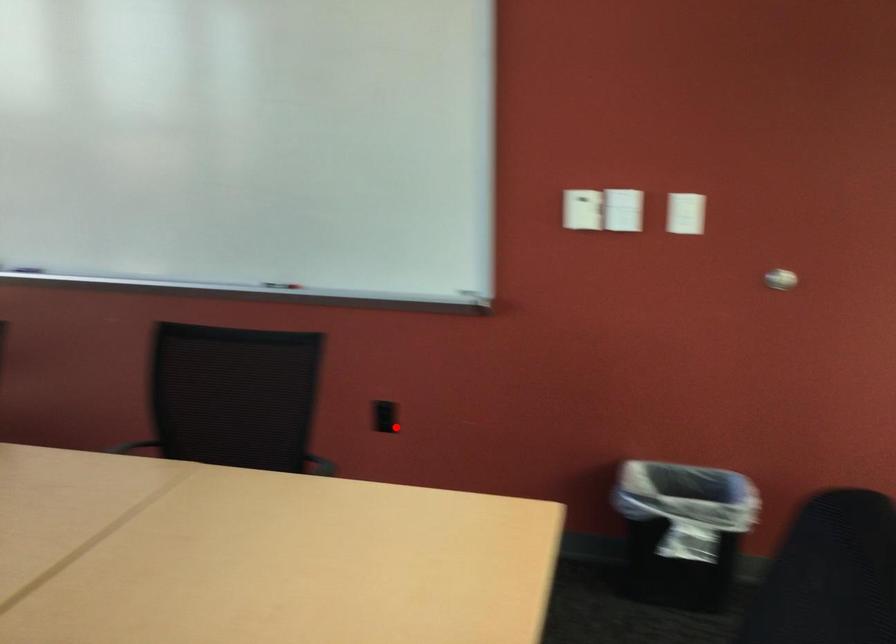
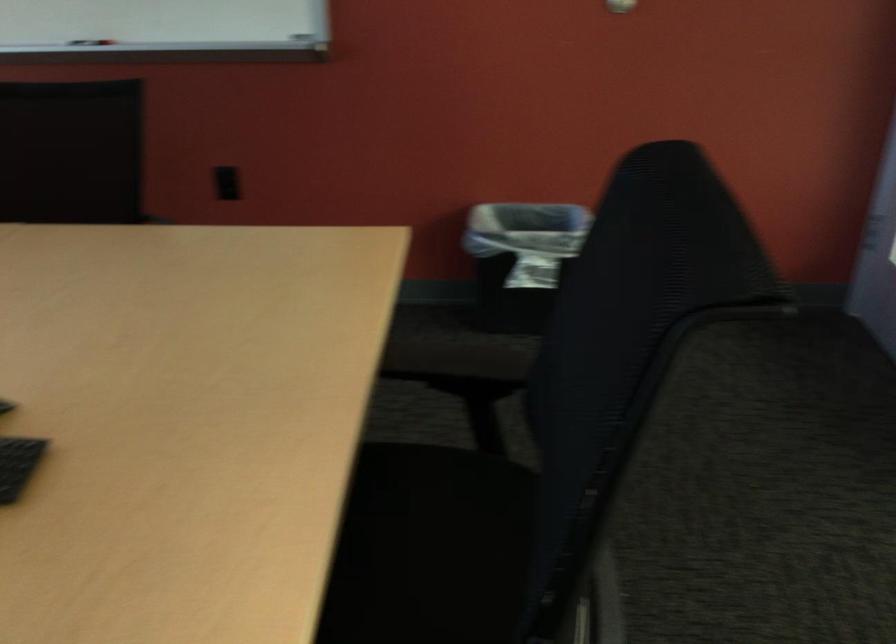
Locate, in the second image, the point that corresponds to the highlighted location in the first image.

(227, 183)